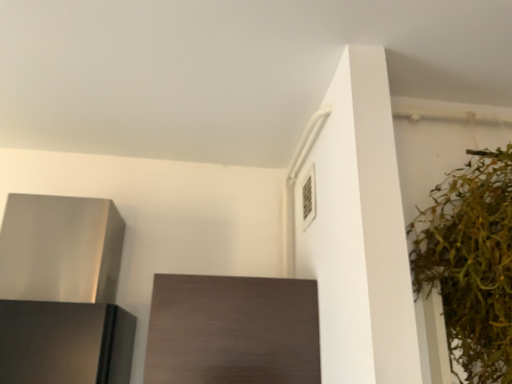
What do you see at coordinates (62, 292) in the screenshot?
I see `satin silver range hood at left` at bounding box center [62, 292].

Where is `dark wood cabinet at center`? dark wood cabinet at center is located at coordinates (232, 330).

What do you see at coordinates (470, 263) in the screenshot? The height and width of the screenshot is (384, 512). I see `green leafy plant at right` at bounding box center [470, 263].

Identify the location of satin silver range hood at left. The width and height of the screenshot is (512, 384). (62, 292).

Identify the location of cabinetry behind the green leafy plant at right. This screenshot has height=384, width=512. (232, 330).

From the picture: Is the surface of green leafy plant at right in direct contact with dark wood cabinet at center?

No, green leafy plant at right is not in contact with dark wood cabinet at center.

Can you confirm if green leafy plant at right is shorter than dark wood cabinet at center?

Incorrect, the height of green leafy plant at right does not fall short of that of dark wood cabinet at center.

Looking at this image, between dark wood cabinet at center and green leafy plant at right, which one has larger size?

green leafy plant at right is bigger.

Which is behind, point (302, 301) or point (451, 333)?

The point (302, 301) is more distant.

What are the coordinates of `cabinetry that appears behind the green leafy plant at right` in the screenshot? It's located at (232, 330).

Is dark wood cabinet at center facing towards green leafy plant at right?

No, dark wood cabinet at center is not aimed at green leafy plant at right.

Consider the image. In terms of size, does satin silver range hood at left appear bigger or smaller than green leafy plant at right?

Clearly, satin silver range hood at left is smaller in size than green leafy plant at right.

From a real-world perspective, who is located higher, satin silver range hood at left or green leafy plant at right?

green leafy plant at right, from a real-world perspective.

Is satin silver range hood at left directly adjacent to green leafy plant at right?

They are not placed beside each other.

Which object is closer to the camera taking this photo, dark wood cabinet at center or satin silver range hood at left?

Positioned in front is satin silver range hood at left.

Is dark wood cabinet at center located outside satin silver range hood at left?

dark wood cabinet at center lies outside satin silver range hood at left's area.

From a real-world perspective, is dark wood cabinet at center physically above satin silver range hood at left?

Actually, dark wood cabinet at center is physically below satin silver range hood at left in the real world.

Locate an element on the screen. This screenshot has height=384, width=512. cabinetry below the satin silver range hood at left (from the image's perspective) is located at coordinates (232, 330).

Which of these two, green leafy plant at right or satin silver range hood at left, is smaller?

Smaller between the two is satin silver range hood at left.

How different are the orientations of green leafy plant at right and satin silver range hood at left in degrees?

5.37e-05 degrees separate the facing orientations of green leafy plant at right and satin silver range hood at left.

From the image's perspective, is green leafy plant at right located beneath satin silver range hood at left?

No.

The image size is (512, 384). I want to click on appliance below the green leafy plant at right (from the image's perspective), so 62,292.

Considering their positions, is satin silver range hood at left located in front of or behind dark wood cabinet at center?

Visually, satin silver range hood at left is located in front of dark wood cabinet at center.

Considering the relative sizes of satin silver range hood at left and dark wood cabinet at center in the image provided, is satin silver range hood at left bigger than dark wood cabinet at center?

Yes, satin silver range hood at left is bigger than dark wood cabinet at center.

Which of these two, satin silver range hood at left or dark wood cabinet at center, is wider?

satin silver range hood at left is wider.

This screenshot has height=384, width=512. In order to click on houseplant above the dark wood cabinet at center (from a real-world perspective) in this screenshot , I will do `click(470, 263)`.

Find the location of `houseplant in front of the dark wood cabinet at center`. houseplant in front of the dark wood cabinet at center is located at coordinates (470, 263).

Estimate the real-world distances between objects in this image. Which object is closer to green leafy plant at right, dark wood cabinet at center or satin silver range hood at left?

Among the two, dark wood cabinet at center is located nearer to green leafy plant at right.

From the picture: Which object lies further to the anchor point dark wood cabinet at center, green leafy plant at right or satin silver range hood at left?

green leafy plant at right is further to dark wood cabinet at center.

Based on their spatial positions, is green leafy plant at right or dark wood cabinet at center closer to satin silver range hood at left?

dark wood cabinet at center lies closer to satin silver range hood at left than the other object.

Considering their positions, is dark wood cabinet at center positioned closer to satin silver range hood at left than green leafy plant at right?

dark wood cabinet at center is positioned closer to the anchor satin silver range hood at left.

Based on their spatial positions, is satin silver range hood at left or green leafy plant at right closer to dark wood cabinet at center?

Among the two, satin silver range hood at left is located nearer to dark wood cabinet at center.

From the image, which object appears to be farther from green leafy plant at right, satin silver range hood at left or dark wood cabinet at center?

Based on the image, satin silver range hood at left appears to be further to green leafy plant at right.

I want to click on cabinetry between satin silver range hood at left and green leafy plant at right in the horizontal direction, so click(x=232, y=330).